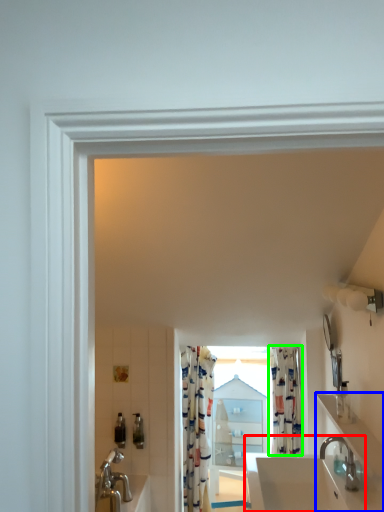
Question: Which object is the closest to the sink (highlighted by a red box)? Choose among these: counter top (highlighted by a blue box) or shower curtain (highlighted by a green box).

Choices:
 (A) counter top
 (B) shower curtain

Answer: (A)